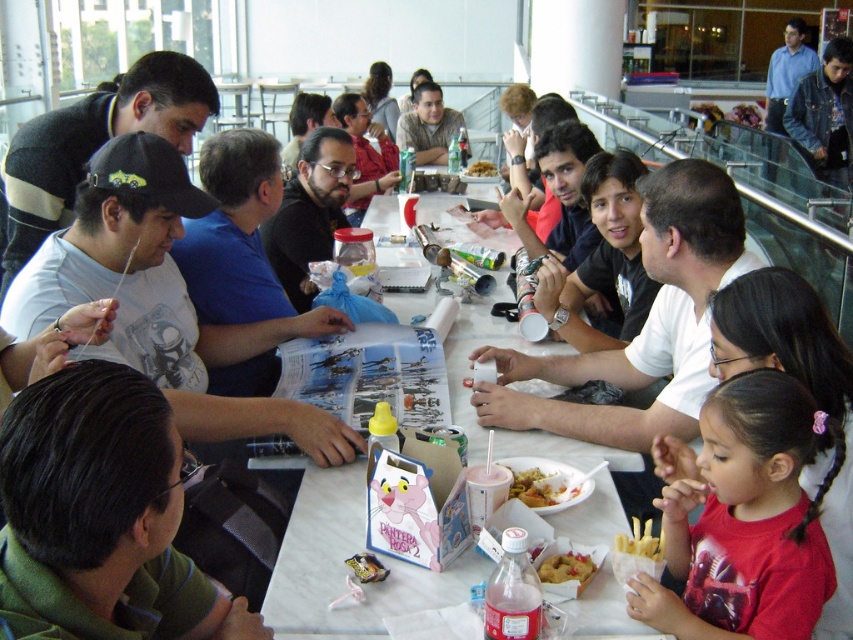
Question: Can you confirm if red cotton shirt at lower right is positioned to the right of shiny plastic cup at center?

Choices:
 (A) no
 (B) yes

Answer: (B)

Question: Among these points, which one is nearest to the camera?

Choices:
 (A) (415, 305)
 (B) (479, 161)
 (C) (555, 484)

Answer: (C)

Question: Is matte black shirt at center positioned before shiny plastic cup at center?

Choices:
 (A) yes
 (B) no

Answer: (B)

Question: Is red cotton shirt at lower right in front of matte black shirt at center?

Choices:
 (A) yes
 (B) no

Answer: (A)

Question: Which object is positioned closest to the shiny plastic cup at center?

Choices:
 (A) golden crispy french fries at lower center
 (B) green fabric shirt at lower left
 (C) red cotton shirt at lower right

Answer: (A)

Question: Which object is positioned farthest from the matte black shirt at center?

Choices:
 (A) shiny plastic cup at center
 (B) golden crispy french fries at lower center
 (C) green fabric shirt at lower left

Answer: (C)